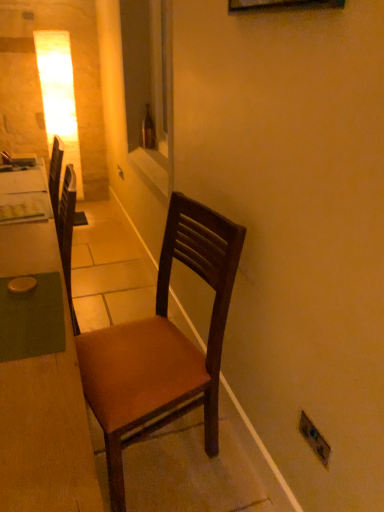
Image resolution: width=384 pixels, height=512 pixels. What do you see at coordinates (163, 345) in the screenshot?
I see `brown leather chair at center` at bounding box center [163, 345].

Locate an element on the screen. Image resolution: width=384 pixels, height=512 pixels. matte plastic electric outlet at lower right is located at coordinates (314, 439).

From a real-world perspective, which is physically above, white glossy window sill at center or brown leather chair at center?

From a 3D spatial view, white glossy window sill at center is above.

Which object is thinner, white glossy window sill at center or brown leather chair at center?

white glossy window sill at center is thinner.

Which of these two, white glossy window sill at center or brown leather chair at center, stands shorter?

With less height is white glossy window sill at center.

Does white glossy window sill at center have a larger size compared to brown leather chair at center?

No, white glossy window sill at center is not bigger than brown leather chair at center.

Considering the relative sizes of wooden desk at left and matte plastic electric outlet at lower right in the image provided, is wooden desk at left smaller than matte plastic electric outlet at lower right?

Incorrect, wooden desk at left is not smaller in size than matte plastic electric outlet at lower right.

Does wooden desk at left lie behind matte plastic electric outlet at lower right?

No, it is in front of matte plastic electric outlet at lower right.

Is point (18, 455) more distant than point (322, 448)?

No, (18, 455) is closer to viewer.

Is wooden desk at left positioned far away from matte plastic electric outlet at lower right?

They are positioned close to each other.

Considering their positions, is brown leather chair at center located in front of or behind brown glass bottle at center?

brown leather chair at center is in front of brown glass bottle at center.

Is brown leather chair at center oriented towards brown glass bottle at center?

No, brown leather chair at center is not aimed at brown glass bottle at center.

From a real-world perspective, is brown leather chair at center above or below brown glass bottle at center?

In terms of real-world spatial position, brown leather chair at center is below brown glass bottle at center.

Is brown leather chair at center completely or partially outside of brown glass bottle at center?

Absolutely, brown leather chair at center is external to brown glass bottle at center.

Which of these two, matte plastic electric outlet at lower right or wooden desk at left, stands shorter?

matte plastic electric outlet at lower right is shorter.

Does point (320, 458) come in front of point (3, 231)?

That is True.

Can you confirm if matte plastic electric outlet at lower right is positioned to the left of wooden desk at left?

In fact, matte plastic electric outlet at lower right is to the right of wooden desk at left.

I want to click on electric outlet on the right of the wooden desk at left, so click(314, 439).

Looking at this image, is matte plastic electric outlet at lower right aimed at white glossy window sill at center?

No, matte plastic electric outlet at lower right is not oriented towards white glossy window sill at center.

Which is correct: matte plastic electric outlet at lower right is inside white glossy window sill at center, or outside of it?

matte plastic electric outlet at lower right is spatially situated outside white glossy window sill at center.

This screenshot has height=512, width=384. I want to click on window sill behind the matte plastic electric outlet at lower right, so click(152, 167).

Is matte plastic electric outlet at lower right wider or thinner than white glossy window sill at center?

In the image, matte plastic electric outlet at lower right appears to be more narrow than white glossy window sill at center.

Where is `chair in front of the white glossy window sill at center`? chair in front of the white glossy window sill at center is located at coordinates (163, 345).

Does brown leather chair at center lie behind white glossy window sill at center?

No.

Is brown leather chair at center positioned far away from white glossy window sill at center?

brown leather chair at center is positioned a significant distance from white glossy window sill at center.

From the picture: Choose the correct answer: Is brown leather chair at center inside white glossy window sill at center or outside it?

brown leather chair at center is not inside white glossy window sill at center, it's outside.

Considering the positions of objects wooden desk at left and brown glass bottle at center in the image provided, who is more to the right, wooden desk at left or brown glass bottle at center?

Positioned to the right is brown glass bottle at center.

Could you tell me if wooden desk at left is turned towards brown glass bottle at center?

No, wooden desk at left is not oriented towards brown glass bottle at center.

This screenshot has height=512, width=384. In order to click on bottle above the wooden desk at left (from a real-world perspective) in this screenshot , I will do point(148,130).

Would you consider wooden desk at left to be distant from brown glass bottle at center?

Yes, wooden desk at left and brown glass bottle at center are located far from each other.

Where is `window sill to the left of brown leather chair at center`? This screenshot has height=512, width=384. window sill to the left of brown leather chair at center is located at coordinates (152, 167).

The image size is (384, 512). In the image, there is a matte plastic electric outlet at lower right. What are the coordinates of `desk below it (from a real-world perspective)` in the screenshot? It's located at (42, 382).

When comparing their distances from wooden desk at left, does brown glass bottle at center or white glossy window sill at center seem closer?

white glossy window sill at center is positioned closer to the anchor wooden desk at left.

Considering their positions, is white glossy window sill at center positioned further to brown leather chair at center than wooden desk at left?

white glossy window sill at center lies further to brown leather chair at center than the other object.

When comparing their distances from wooden desk at left, does brown glass bottle at center or matte plastic electric outlet at lower right seem closer?

matte plastic electric outlet at lower right is closer to wooden desk at left.

Which object lies nearer to the anchor point wooden desk at left, brown leather chair at center or white glossy window sill at center?

brown leather chair at center is positioned closer to the anchor wooden desk at left.

Based on the photo, considering their positions, is brown leather chair at center positioned further to brown glass bottle at center than wooden desk at left?

brown leather chair at center is positioned further to the anchor brown glass bottle at center.

Which object lies nearer to the anchor point matte plastic electric outlet at lower right, brown glass bottle at center or wooden desk at left?

wooden desk at left is positioned closer to the anchor matte plastic electric outlet at lower right.

Looking at the image, which one is located further to matte plastic electric outlet at lower right, brown glass bottle at center or brown leather chair at center?

brown glass bottle at center lies further to matte plastic electric outlet at lower right than the other object.

Which object lies nearer to the anchor point white glossy window sill at center, brown glass bottle at center or matte plastic electric outlet at lower right?

Among the two, brown glass bottle at center is located nearer to white glossy window sill at center.

This screenshot has width=384, height=512. I want to click on chair between wooden desk at left and matte plastic electric outlet at lower right, so click(163, 345).

Find the location of a particular element. window sill between wooden desk at left and brown glass bottle at center in the front-back direction is located at coordinates (152, 167).

Locate an element on the screen. This screenshot has height=512, width=384. window sill located between brown leather chair at center and brown glass bottle at center in the depth direction is located at coordinates (152, 167).

The image size is (384, 512). I want to click on electric outlet located between wooden desk at left and brown glass bottle at center in the depth direction, so [x=314, y=439].